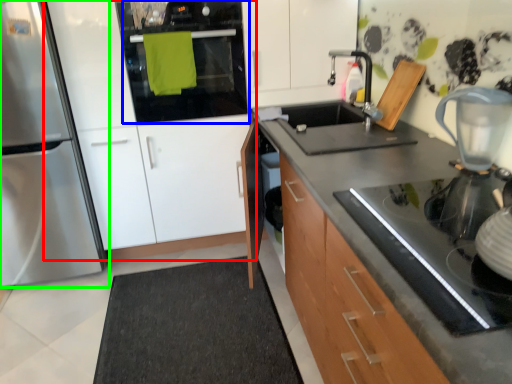
Question: Estimate the real-world distances between objects in this image. Which object is closer to cabinetry (highlighted by a red box), oven (highlighted by a blue box) or home appliance (highlighted by a green box)?

Choices:
 (A) oven
 (B) home appliance

Answer: (A)